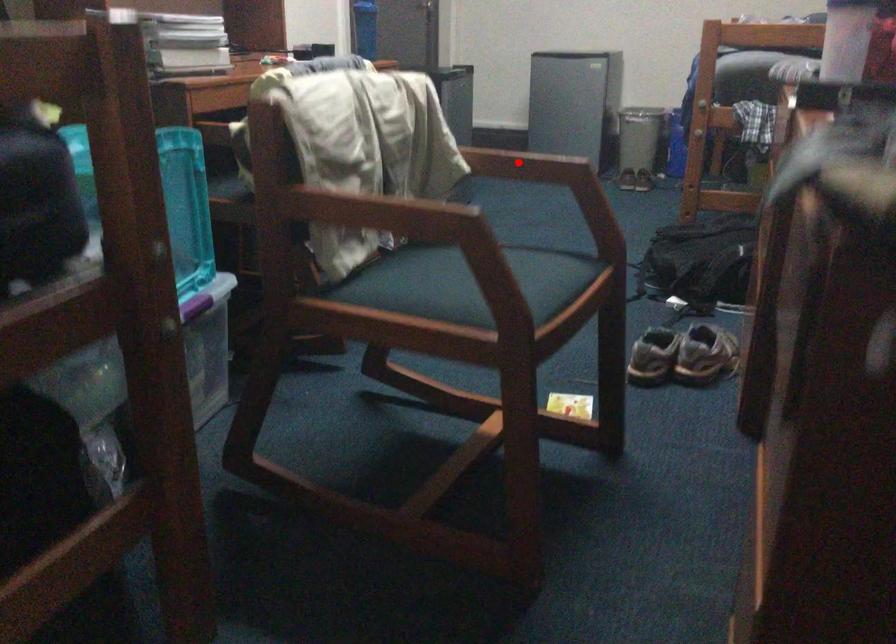
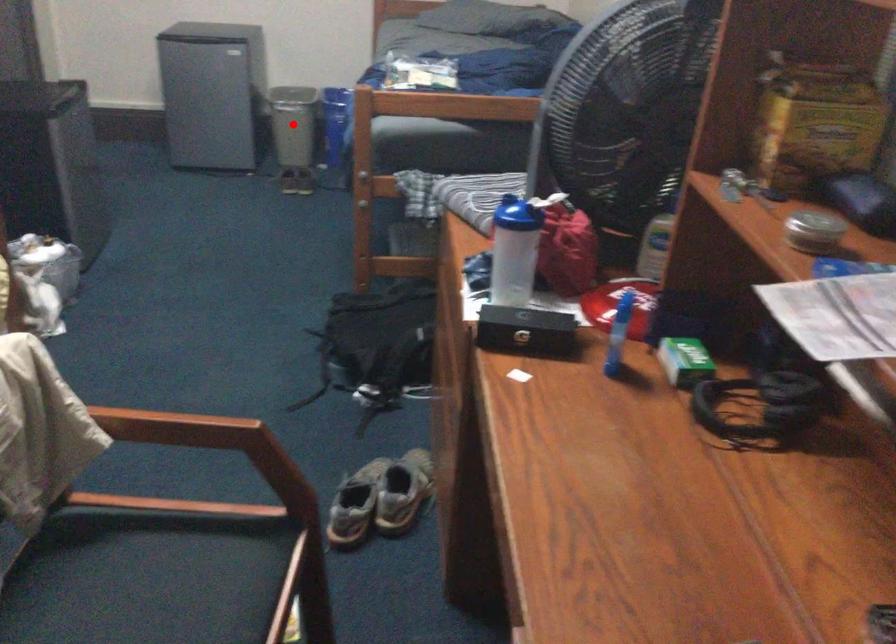
I am providing you with two images of the same scene from different viewpoints. A red point is marked on the first image and another point is marked on the second image. Do the highlighted points in image1 and image2 indicate the same real-world spot?

No